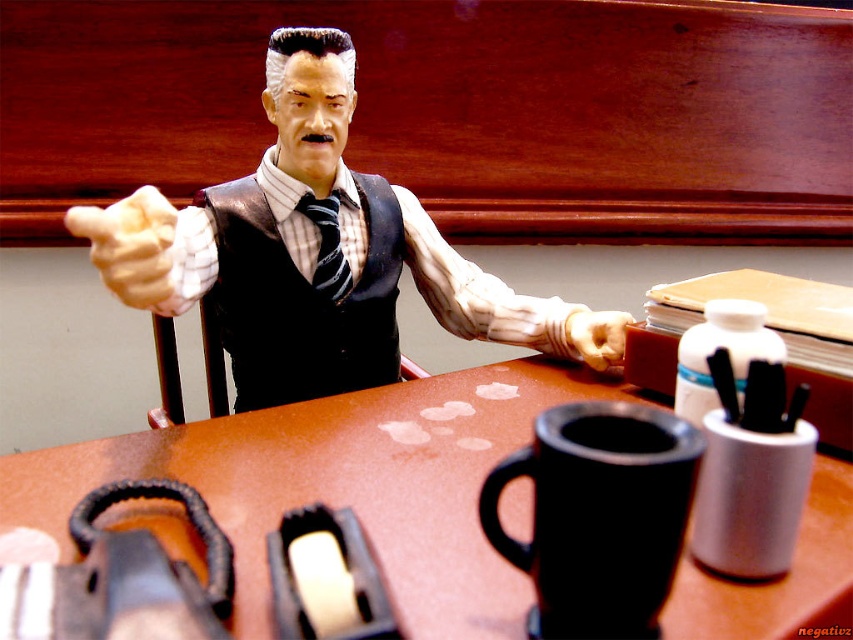
Question: Is brown matte table at center above black matte coffee cup at lower center?

Choices:
 (A) yes
 (B) no

Answer: (B)

Question: Among these points, which one is nearest to the camera?

Choices:
 (A) (637, 426)
 (B) (271, 124)
 (C) (364, 451)

Answer: (A)

Question: From the image, what is the correct spatial relationship of matte black vest at center in relation to black matte coffee cup at lower center?

Choices:
 (A) left
 (B) right

Answer: (A)

Question: Which point is closer to the camera taking this photo?

Choices:
 (A) (548, 392)
 (B) (274, 353)

Answer: (A)

Question: Which point is closer to the camera?

Choices:
 (A) coord(364,401)
 (B) coord(657,436)
 (C) coord(439,278)

Answer: (B)

Question: Does matte black vest at center come behind black matte coffee cup at lower center?

Choices:
 (A) no
 (B) yes

Answer: (B)